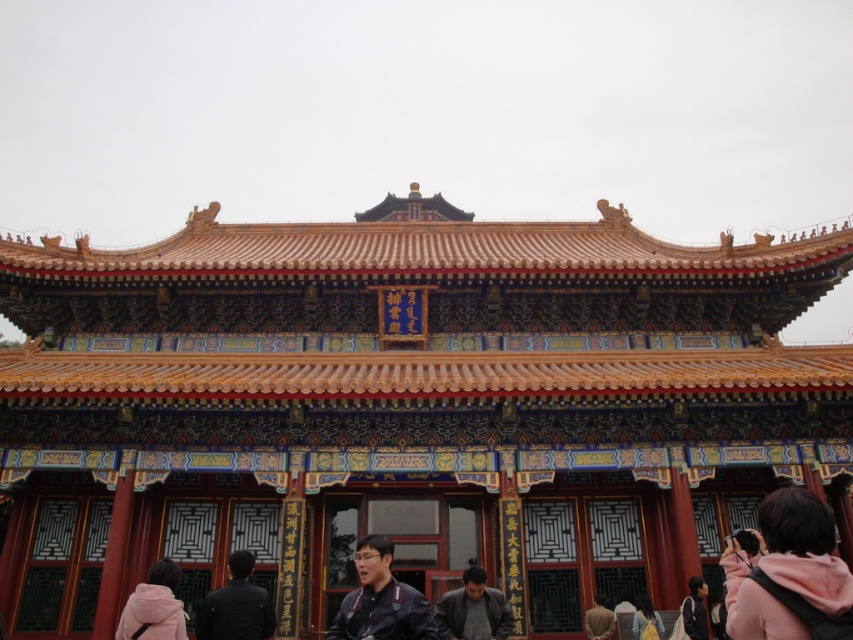
You are a tour guide standing 20 meters away from a traditional Chinese building. You notice a dark gray fabric jacket at lower center in the scene. Can you reach the jacket before the rain starts if you need to walk 20 meters to the building?

The dark gray fabric jacket at lower center is 19.79 meters away from the viewer. Since you need to walk 20 meters to reach the building, you can almost reach the jacket before the rain starts, but you might be a little short of the distance required.

You are standing in front of the traditional Chinese building and want to take a photo. You notice two points marked in the scene. Which point, point (152, 636) or point (593, 596), is closer to your camera lens?

Point (152, 636) is closer to the camera than point (593, 596).